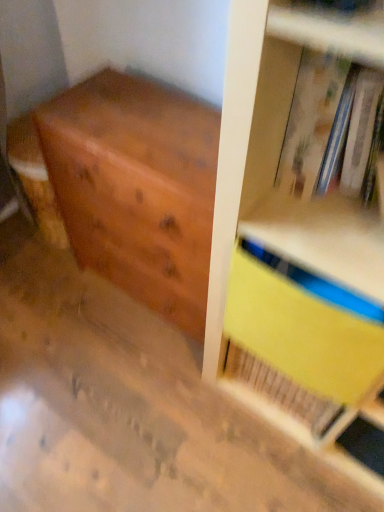
Question: Considering the relative positions of hardcover book at upper right and yellow matte paper at upper right in the image provided, is hardcover book at upper right to the left or to the right of yellow matte paper at upper right?

Choices:
 (A) left
 (B) right

Answer: (B)

Question: Is hardcover book at upper right wider or thinner than yellow matte paper at upper right?

Choices:
 (A) wide
 (B) thin

Answer: (A)

Question: Which object is positioned farthest from the wooden chest of drawers at left?

Choices:
 (A) yellow matte paper at upper right
 (B) hardcover book at upper right

Answer: (B)

Question: Estimate the real-world distances between objects in this image. Which object is farther from the yellow matte paper at upper right?

Choices:
 (A) wooden chest of drawers at left
 (B) hardcover book at upper right

Answer: (A)